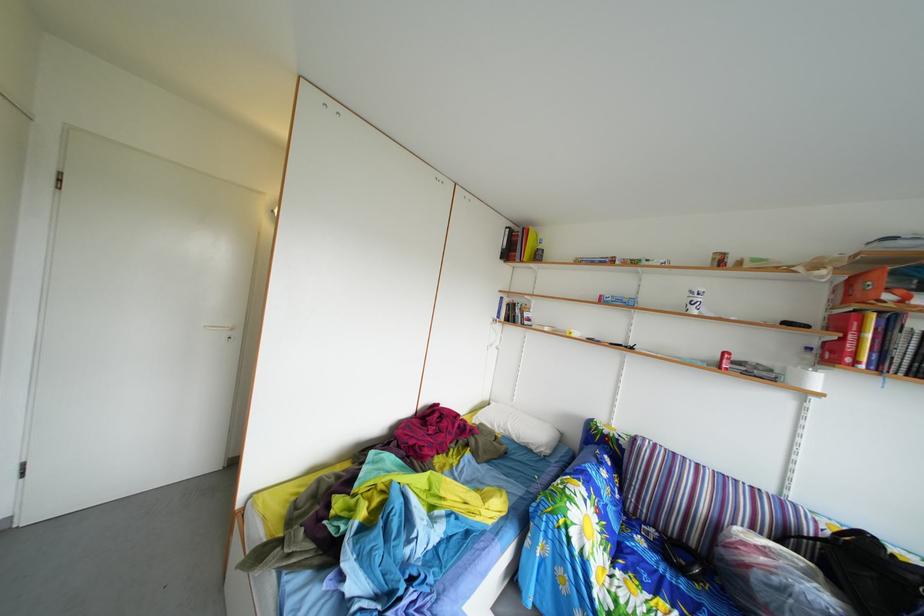
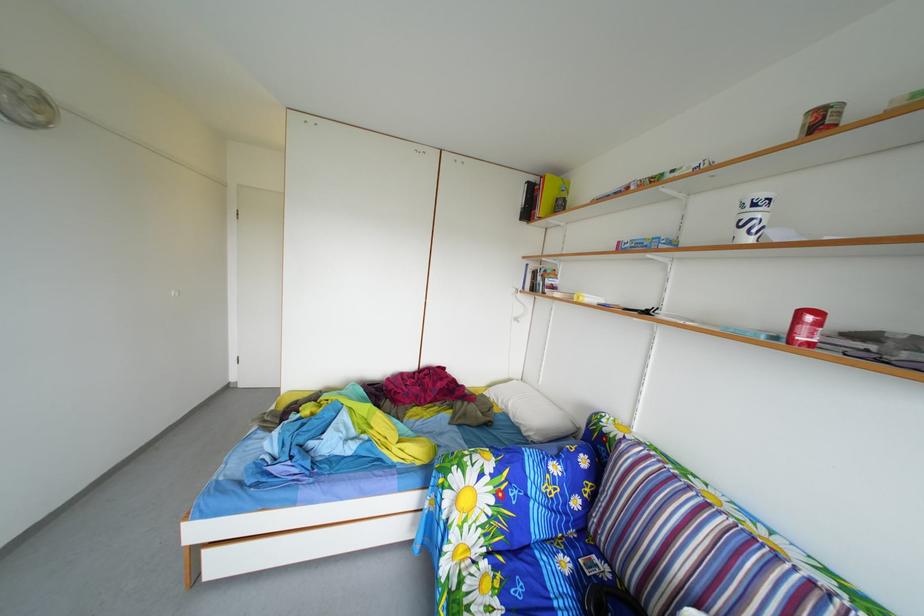
In the second image, find the point that corresponds to pixel 735 362 in the first image.

(811, 321)